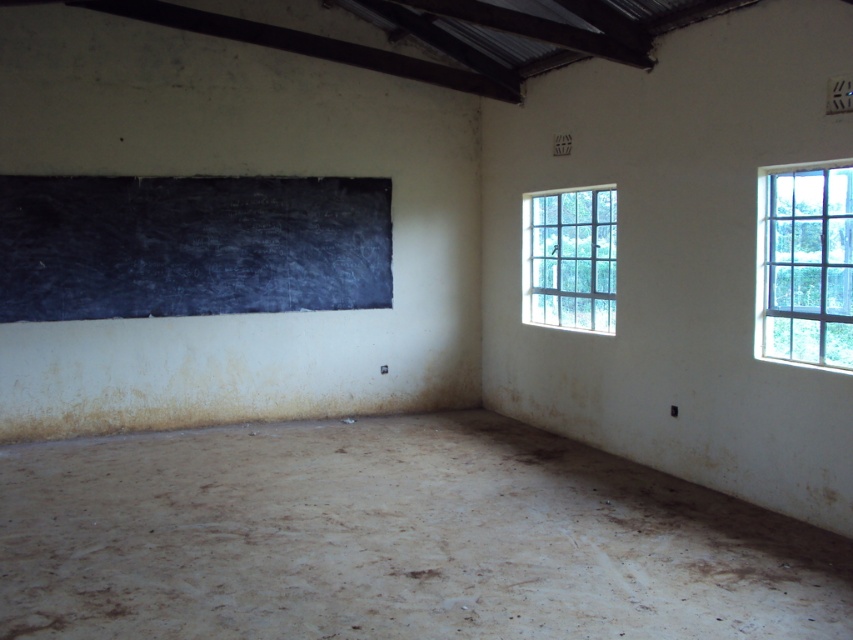
Between black chalkboard at upper left and clear glass window at right, which one has less height?

Standing shorter between the two is clear glass window at right.

Does black chalkboard at upper left appear on the left side of clear glass window at right?

Correct, you'll find black chalkboard at upper left to the left of clear glass window at right.

Image resolution: width=853 pixels, height=640 pixels. What do you see at coordinates (190, 244) in the screenshot?
I see `black chalkboard at upper left` at bounding box center [190, 244].

Where is `black chalkboard at upper left`? The height and width of the screenshot is (640, 853). black chalkboard at upper left is located at coordinates (190, 244).

Describe the element at coordinates (190, 244) in the screenshot. The image size is (853, 640). I see `black chalkboard at upper left` at that location.

Can you confirm if black chalkboard at upper left is positioned to the right of clear glass window at upper right?

Incorrect, black chalkboard at upper left is not on the right side of clear glass window at upper right.

Is point (115, 228) closer to viewer compared to point (814, 250)?

No.

The height and width of the screenshot is (640, 853). Identify the location of black chalkboard at upper left. (190, 244).

The height and width of the screenshot is (640, 853). I want to click on clear glass window at upper right, so click(x=805, y=264).

Which is in front, point (844, 189) or point (592, 230)?

Point (844, 189) is more forward.

Where is `clear glass window at upper right`? The height and width of the screenshot is (640, 853). clear glass window at upper right is located at coordinates (805, 264).